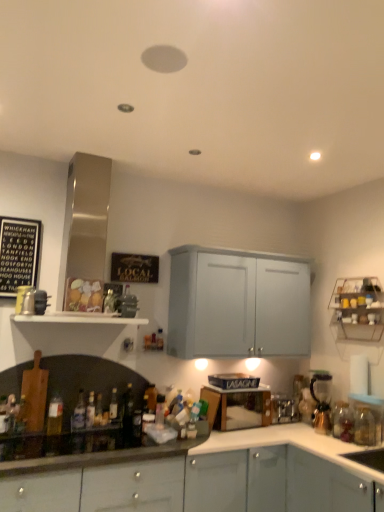
This screenshot has width=384, height=512. Identify the location of vacant space that is to the left of gold metallic coffee machine at right. (292, 430).